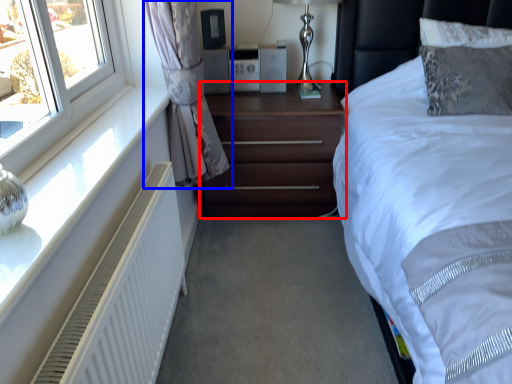
Question: Which of the following is the closest to the observer, nightstand (highlighted by a red box) or curtain (highlighted by a blue box)?

Choices:
 (A) nightstand
 (B) curtain

Answer: (B)